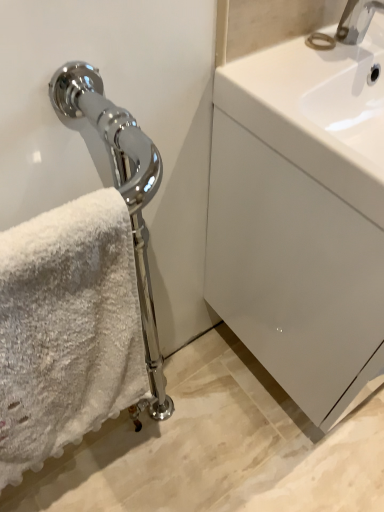
Question: Can we say chrome metallic faucet at upper right lies outside white glossy sink at upper right?

Choices:
 (A) no
 (B) yes

Answer: (B)

Question: From the image's perspective, is chrome metallic faucet at upper right below white glossy sink at upper right?

Choices:
 (A) no
 (B) yes

Answer: (A)

Question: Considering the relative sizes of chrome metallic faucet at upper right and white glossy sink at upper right in the image provided, is chrome metallic faucet at upper right taller than white glossy sink at upper right?

Choices:
 (A) yes
 (B) no

Answer: (B)

Question: Is chrome metallic faucet at upper right shorter than white glossy sink at upper right?

Choices:
 (A) yes
 (B) no

Answer: (A)

Question: Considering the relative sizes of chrome metallic faucet at upper right and white glossy sink at upper right in the image provided, is chrome metallic faucet at upper right smaller than white glossy sink at upper right?

Choices:
 (A) yes
 (B) no

Answer: (A)

Question: From a real-world perspective, is white fluffy towel at left physically located above or below chrome metallic faucet at upper right?

Choices:
 (A) above
 (B) below

Answer: (B)

Question: From their relative heights in the image, would you say white fluffy towel at left is taller or shorter than chrome metallic faucet at upper right?

Choices:
 (A) short
 (B) tall

Answer: (B)

Question: Is white fluffy towel at left wider or thinner than chrome metallic faucet at upper right?

Choices:
 (A) thin
 (B) wide

Answer: (A)

Question: Looking at the image, does white fluffy towel at left seem bigger or smaller compared to chrome metallic faucet at upper right?

Choices:
 (A) small
 (B) big

Answer: (B)

Question: In the image, is white glossy drawer at right positioned in front of or behind white fluffy towel at left?

Choices:
 (A) front
 (B) behind

Answer: (B)

Question: From a real-world perspective, is white glossy drawer at right positioned above or below white fluffy towel at left?

Choices:
 (A) above
 (B) below

Answer: (B)

Question: Considering the positions of point (266, 182) and point (3, 321), is point (266, 182) closer or farther from the camera than point (3, 321)?

Choices:
 (A) closer
 (B) farther

Answer: (B)

Question: In terms of width, does white glossy drawer at right look wider or thinner when compared to white fluffy towel at left?

Choices:
 (A) wide
 (B) thin

Answer: (A)

Question: Visually, is chrome metallic faucet at upper right positioned to the left or to the right of white glossy drawer at right?

Choices:
 (A) left
 (B) right

Answer: (A)

Question: Is chrome metallic faucet at upper right wider or thinner than white glossy drawer at right?

Choices:
 (A) wide
 (B) thin

Answer: (B)